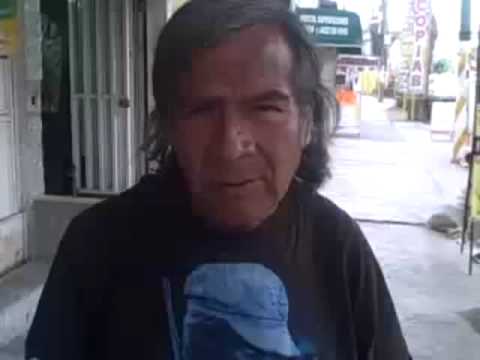
Locate an element on the screen. This screenshot has height=360, width=480. door is located at coordinates (111, 92), (9, 173).